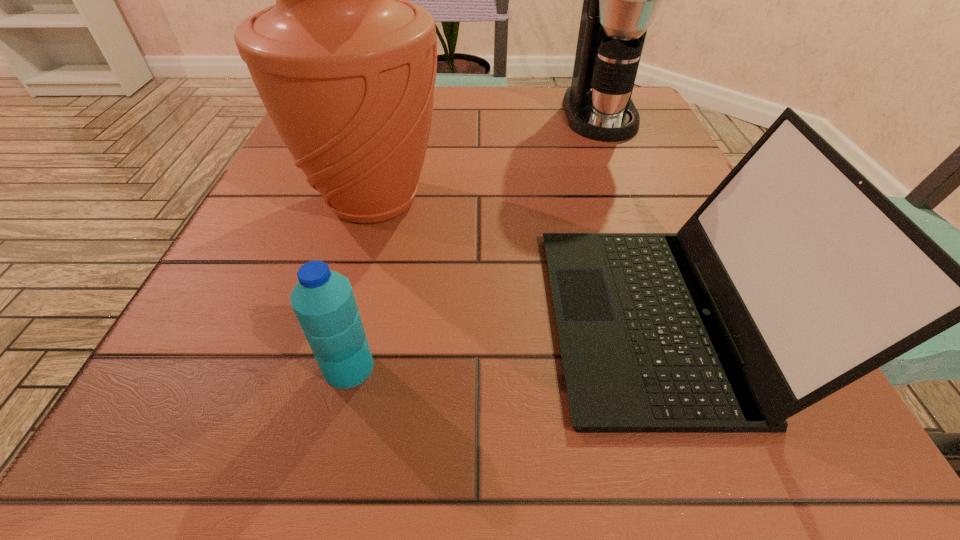
The width and height of the screenshot is (960, 540). Identify the location of blank region between the farthest object and the second shortest object. (631, 216).

Select which object is the third closest to the coffee maker. Please provide its 2D coordinates. Your answer should be formatted as a tuple, i.e. [(x, y)], where the tuple contains the x and y coordinates of a point satisfying the conditions above.

[(323, 301)]

At what (x,y) coordinates should I click in order to perform the action: click on the second closest object to the coffee maker. Please return your answer as a coordinate pair (x, y). This screenshot has width=960, height=540. Looking at the image, I should click on (796, 277).

I want to click on free space that satisfies the following two spatial constraints: 1. place cup under the spout of the farthest object; 2. on the surface of the third tallest object, so click(682, 318).

Where is `vacant area in the image that satisfies the following two spatial constraints: 1. place cup under the spout of the coffee maker; 2. on the surface of the laptop`? vacant area in the image that satisfies the following two spatial constraints: 1. place cup under the spout of the coffee maker; 2. on the surface of the laptop is located at coordinates (682, 318).

Locate an element on the screen. This screenshot has height=540, width=960. vacant area in the image that satisfies the following two spatial constraints: 1. place cup under the spout of the coffee maker; 2. on the surface of the third tallest object is located at coordinates (682, 318).

Identify the location of vacant area that satisfies the following two spatial constraints: 1. place cup under the spout of the coffee maker; 2. on the surface of the laptop. This screenshot has width=960, height=540. (682, 318).